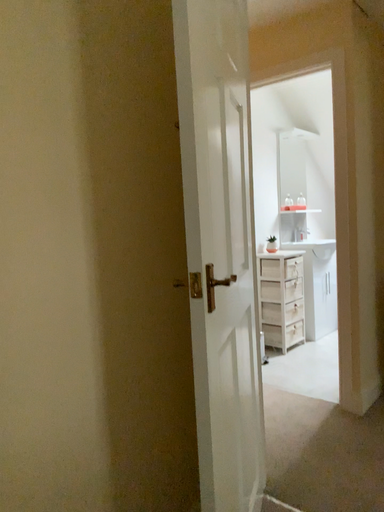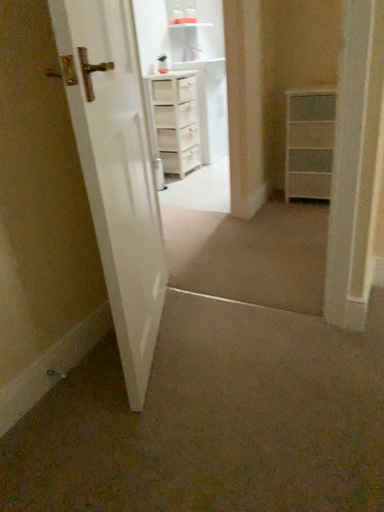
Question: Which way did the camera rotate in the video?

Choices:
 (A) rotated downward
 (B) rotated upward

Answer: (A)